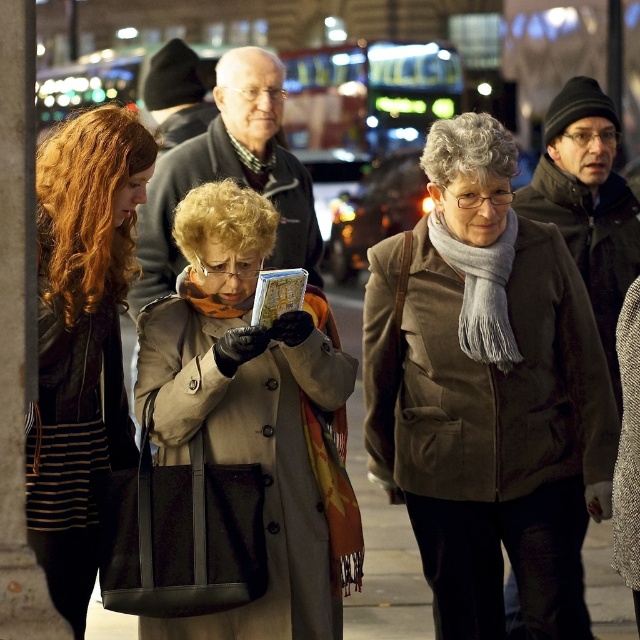
Question: Is brown suede coat at center thinner than beige woolen coat at center?

Choices:
 (A) no
 (B) yes

Answer: (A)

Question: Which point appears closest to the camera in this image?

Choices:
 (A) (192, 227)
 (B) (275, 173)
 (C) (592, 355)
 (D) (486, 129)

Answer: (A)

Question: Which point is closer to the camera taking this photo?

Choices:
 (A) 563,205
 (B) 500,124
 (C) 257,228

Answer: (C)

Question: Does beige woolen coat at center come behind gray woolen wig at center?

Choices:
 (A) yes
 (B) no

Answer: (B)

Question: Does matte black jacket at left come behind dark brown leather coat at center?

Choices:
 (A) no
 (B) yes

Answer: (A)

Question: Which object is positioned closest to the gray woolen wig at center?

Choices:
 (A) curly blonde wig at center
 (B) beige woolen coat at center

Answer: (A)